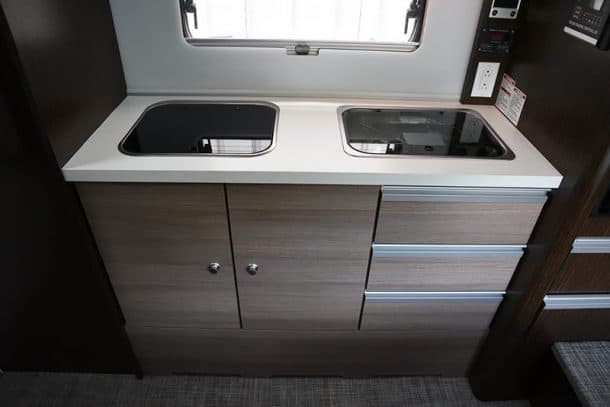
Identify the location of knob. The width and height of the screenshot is (610, 407). (254, 270).